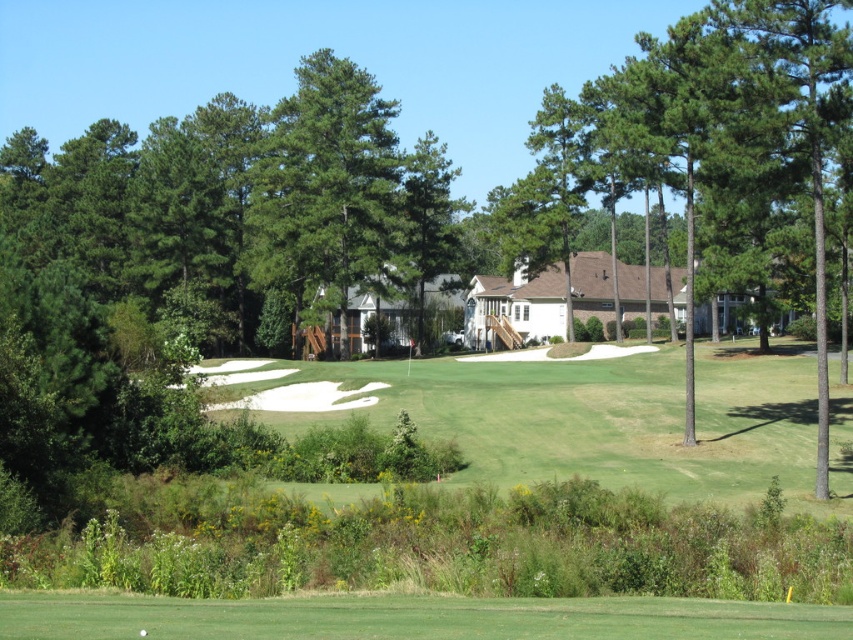
Question: Considering the real-world distances, which object is farthest from the green leafy tree at center?

Choices:
 (A) green grass at lower center
 (B) green grassy fairway at center

Answer: (A)

Question: Which point is closer to the camera taking this photo?

Choices:
 (A) (445, 618)
 (B) (520, 388)
 (C) (329, 209)

Answer: (A)

Question: Can you confirm if green grassy fairway at center is positioned above green leafy tree at center?

Choices:
 (A) yes
 (B) no

Answer: (B)

Question: Is green grass at lower center in front of green leafy tree at center?

Choices:
 (A) yes
 (B) no

Answer: (A)

Question: Which point is farther to the camera?

Choices:
 (A) (352, 168)
 (B) (100, 616)
 (C) (759, 428)

Answer: (A)

Question: Can you confirm if green grassy fairway at center is wider than green leafy tree at center?

Choices:
 (A) yes
 (B) no

Answer: (A)